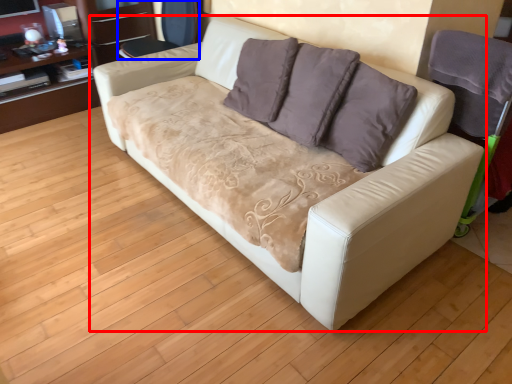
Question: Which object is further to the camera taking this photo, studio couch (highlighted by a red box) or armchair (highlighted by a blue box)?

Choices:
 (A) studio couch
 (B) armchair

Answer: (B)